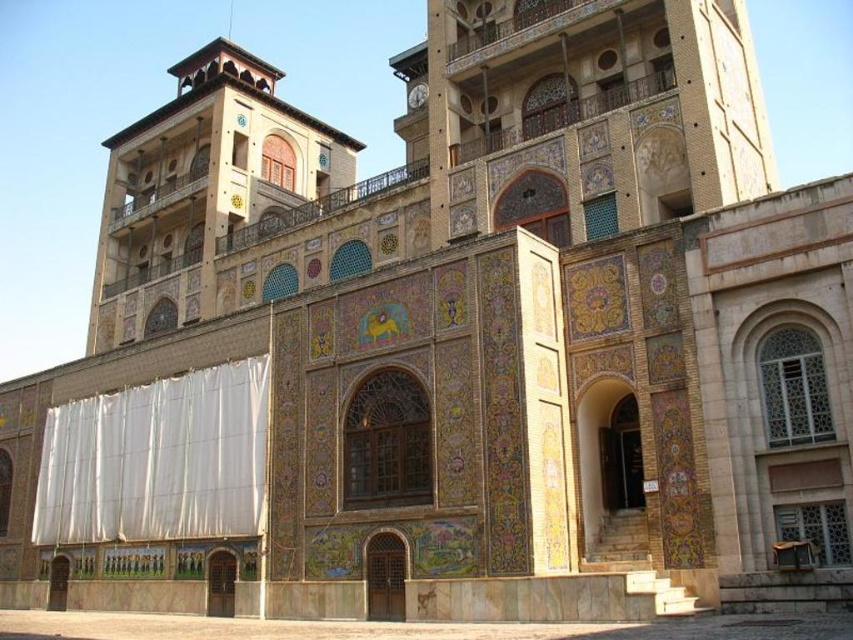
You are standing in front of the grand architectural structure. You notice the yellowish stone tower at upper left and the metallic clock at upper center. Which object is closer to you from your current position?

The yellowish stone tower at upper left is closer to you because it is in front of the metallic clock at upper center.

You are an architect analyzing the building structure. Based on the scene, which object has a greater width between the yellowish stone tower at upper left and the white fabric curtain at lower left?

The yellowish stone tower at upper left is wider than the white fabric curtain at lower left according to the description.